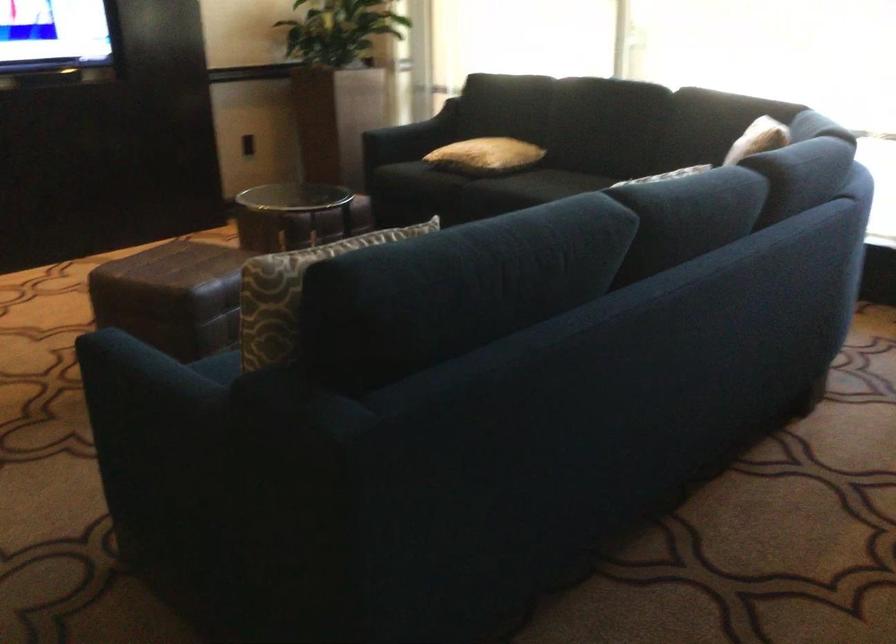
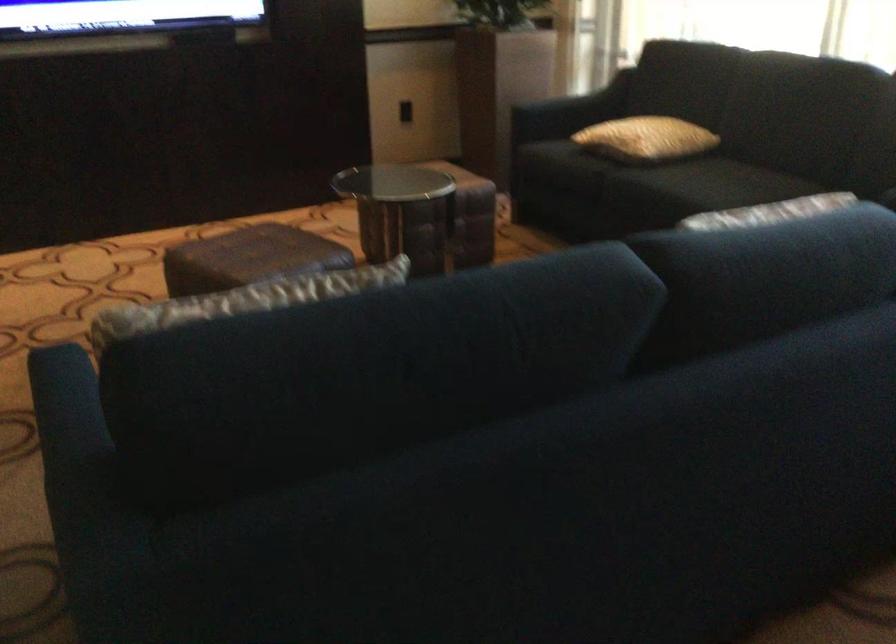
In the second image, find the point that corresponds to point (176, 269) in the first image.

(248, 258)